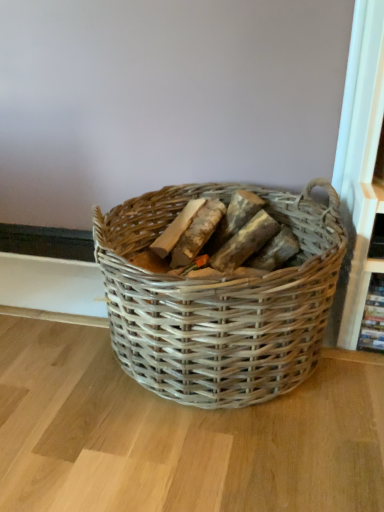
The height and width of the screenshot is (512, 384). In order to click on natural wicker basket at center in this screenshot , I will do `click(219, 302)`.

The image size is (384, 512). What do you see at coordinates (219, 302) in the screenshot?
I see `natural wicker basket at center` at bounding box center [219, 302].

Locate an element on the screen. The image size is (384, 512). natural wicker basket at center is located at coordinates (219, 302).